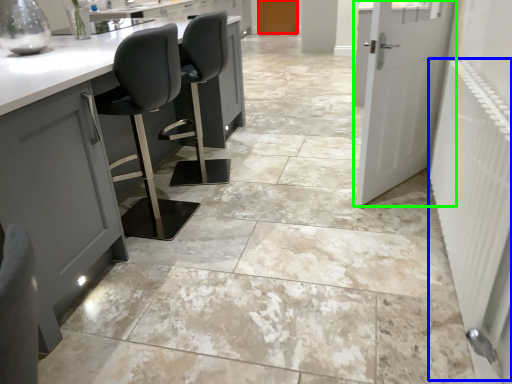
Question: Which is farther away from door (highlighted by a red box)? radiator (highlighted by a blue box) or door (highlighted by a green box)?

Choices:
 (A) radiator
 (B) door

Answer: (A)